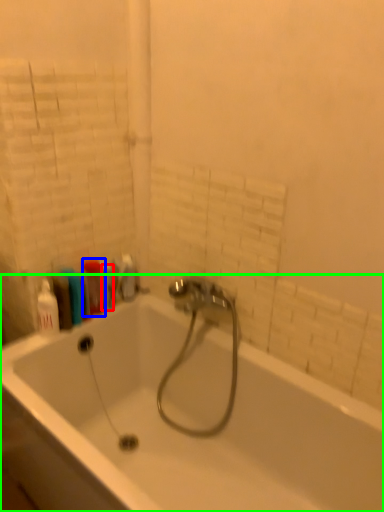
Question: Estimate the real-world distances between objects in this image. Which object is closer to toiletry (highlighted by a red box), cleaning product (highlighted by a blue box) or bathtub (highlighted by a green box)?

Choices:
 (A) cleaning product
 (B) bathtub

Answer: (A)